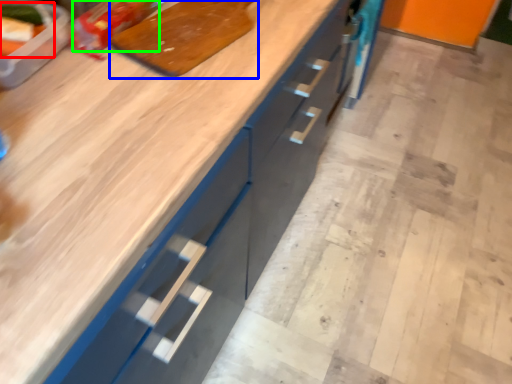
Question: Considering the real-world distances, which object is farthest from food (highlighted by a red box)? cutting board (highlighted by a blue box) or food (highlighted by a green box)?

Choices:
 (A) cutting board
 (B) food

Answer: (A)